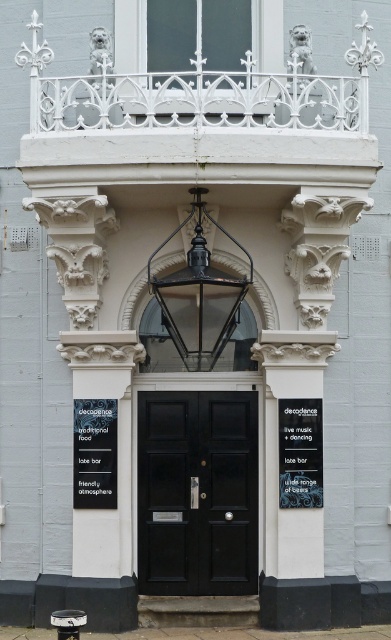
You are standing at the entrance of a Victorian or Edwardian building. There is a point marked at coordinates point (x=252, y=524). If you want to take a photo of this point with a camera that has a 50mm lens, which has a field of view of 46 degrees, would the point be fully visible in the photo?

The point (x=252, y=524) is 57.86 feet away from the camera. To determine visibility, calculate the distance and angle. With a 50mm lens having a 46 degree field of view, the maximum horizontal distance covered is approximately 57.86 feet multiplied by tan 23 degrees. This results in about 23.4 feet. Since the point is within this range, it would be fully visible.

From the picture: You are a delivery person who needs to attach a package label to either the black matte signboard at center or the black paper at lower left. Which object would you choose if you want to ensure the label is visible from a distance?

The black paper at lower left is larger than the black matte signboard at center, so attaching the label to the black paper at lower left would make it more visible from a distance.

You are standing at the entrance of the building and need to locate both the black matte door at center and the black matte signboard at center. According to their positions, which object is on the right side when facing the entrance?

The black matte signboard at center is on the right side because the black matte door at center is to its left.